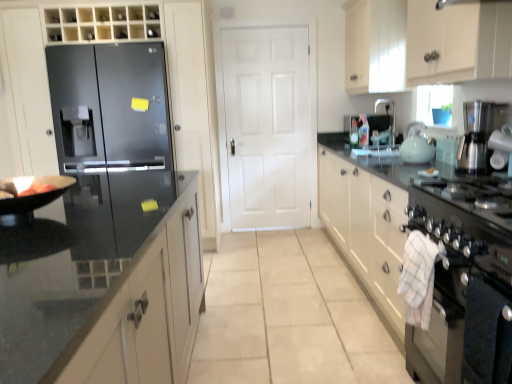
Question: Does white matte door at center have a smaller size compared to white glossy cabinet at upper right, which ranks as the 2th cabinetry in right-to-left order?

Choices:
 (A) no
 (B) yes

Answer: (B)

Question: Does white matte door at center lie behind white glossy cabinet at upper right, which ranks as the 2th cabinetry in right-to-left order?

Choices:
 (A) no
 (B) yes

Answer: (B)

Question: Does white matte door at center have a larger size compared to white glossy cabinet at upper right, positioned as the second cabinetry in left-to-right order?

Choices:
 (A) yes
 (B) no

Answer: (B)

Question: Does white matte door at center have a lesser height compared to white glossy cabinet at upper right, which ranks as the 2th cabinetry in right-to-left order?

Choices:
 (A) yes
 (B) no

Answer: (B)

Question: Would you say white matte door at center contains white glossy cabinet at upper right, which ranks as the 2th cabinetry in right-to-left order?

Choices:
 (A) yes
 (B) no

Answer: (B)

Question: Looking at the image, does white matte door at center seem bigger or smaller compared to satin silver coffee maker at right, marked as the first appliance in a front-to-back arrangement?

Choices:
 (A) small
 (B) big

Answer: (B)

Question: Does point (237, 117) appear closer or farther from the camera than point (508, 139)?

Choices:
 (A) closer
 (B) farther

Answer: (B)

Question: Considering the positions of white matte door at center and satin silver coffee maker at right, the second appliance when ordered from back to front, in the image, is white matte door at center wider or thinner than satin silver coffee maker at right, the second appliance when ordered from back to front,?

Choices:
 (A) thin
 (B) wide

Answer: (A)

Question: Is white matte door at center inside or outside of satin silver coffee maker at right, which appears as the 2th appliance when viewed from the top?

Choices:
 (A) outside
 (B) inside

Answer: (A)

Question: From the image's perspective, is white glossy sink at upper right positioned above or below light blue glass tea pot at right?

Choices:
 (A) below
 (B) above

Answer: (B)

Question: In terms of height, does white glossy sink at upper right look taller or shorter compared to light blue glass tea pot at right?

Choices:
 (A) short
 (B) tall

Answer: (B)

Question: Visually, is white glossy sink at upper right positioned to the left or to the right of light blue glass tea pot at right?

Choices:
 (A) right
 (B) left

Answer: (A)

Question: Do you think white glossy sink at upper right is within light blue glass tea pot at right, or outside of it?

Choices:
 (A) inside
 (B) outside

Answer: (B)

Question: Is black stainless steel oven at lower right taller or shorter than white matte door at center?

Choices:
 (A) tall
 (B) short

Answer: (B)

Question: Relative to white matte door at center, is black stainless steel oven at lower right in front or behind?

Choices:
 (A) behind
 (B) front

Answer: (B)